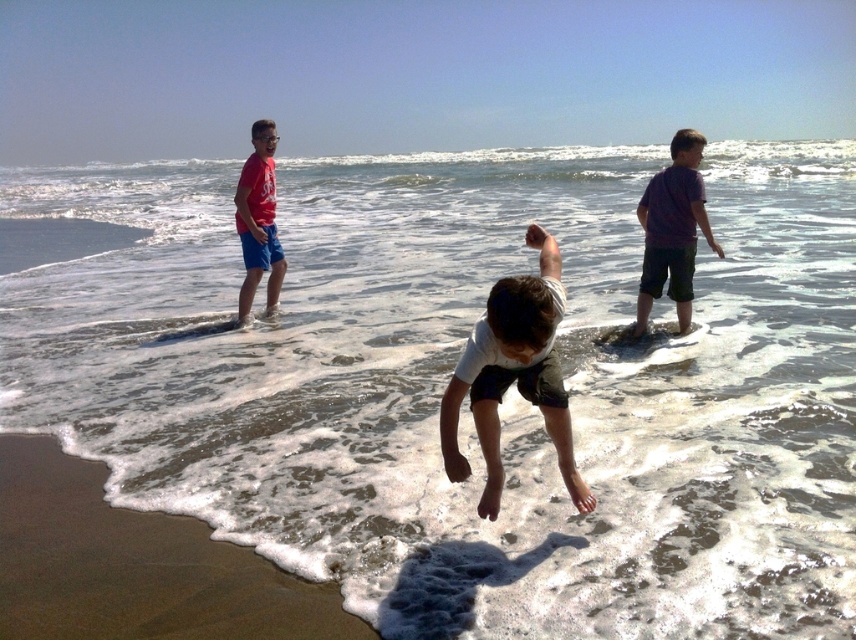
You are standing at the beach scene and want to place a small flag at the closest point between point (x=541, y=321) and point (x=688, y=198). Which point should you choose to place the flag so it is closer to you?

Point (x=541, y=321) is closer to the viewer than point (x=688, y=198), so you should place the flag at point (x=541, y=321) to be closer.

What is the color of the shirt worn by the child located at point (672,228)?

The child at point (672,228) is wearing a purple cotton shirt.